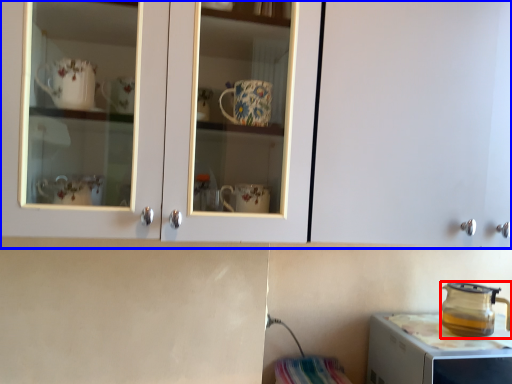
Question: Among these objects, which one is nearest to the camera, kitchen appliance (highlighted by a red box) or cabinetry (highlighted by a blue box)?

Choices:
 (A) kitchen appliance
 (B) cabinetry

Answer: (B)